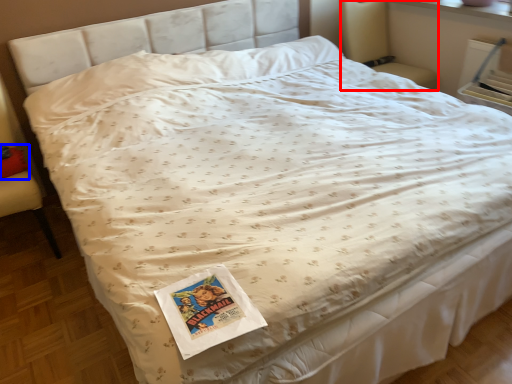
Question: Which object is further to the camera taking this photo, armchair (highlighted by a red box) or pillow (highlighted by a blue box)?

Choices:
 (A) armchair
 (B) pillow

Answer: (A)